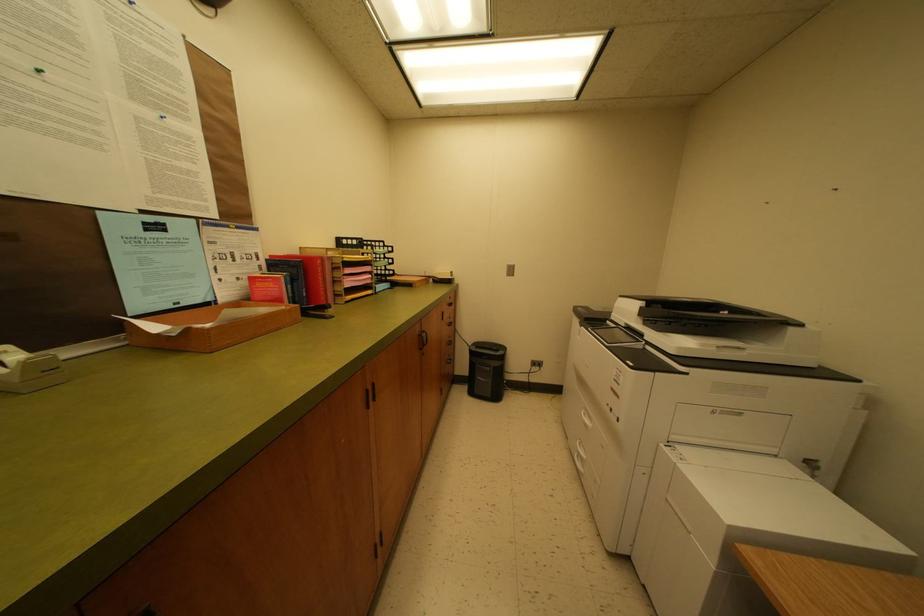
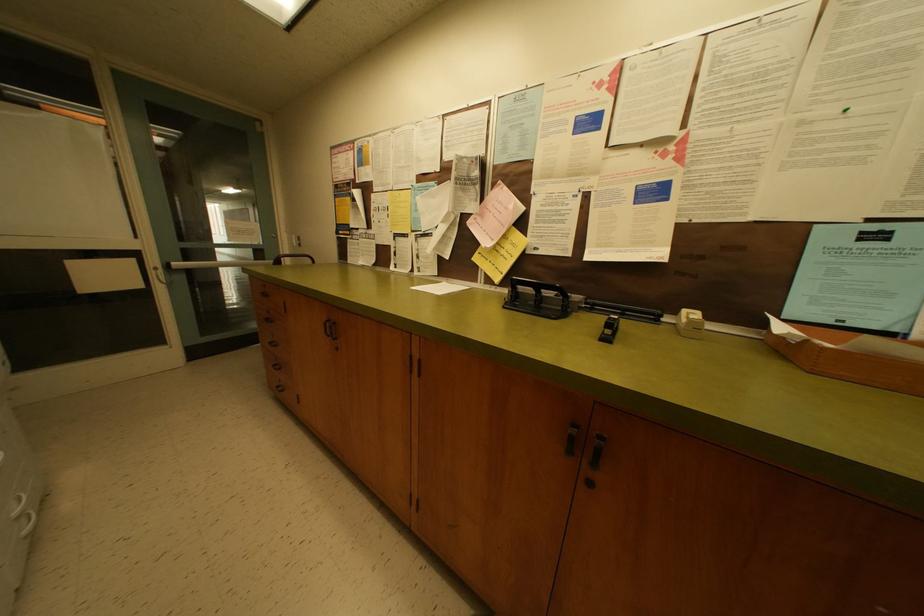
First-person continuous shooting, in which direction is the camera rotating?

The camera rotated toward left-down.